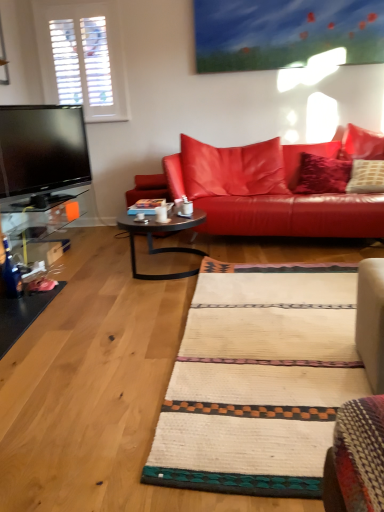
What do you see at coordinates (164, 247) in the screenshot?
I see `metallic black coffee table at center` at bounding box center [164, 247].

In order to face leather couch at center, should I rotate leftwards or rightwards?

To align with it, rotate right about 12.712°.

Describe the element at coordinates (259, 195) in the screenshot. I see `leather couch at center` at that location.

Find the location of a particular element. The width and height of the screenshot is (384, 512). white glossy mug at center is located at coordinates (161, 214).

Considering their positions, is white glossy mug at center located in front of or behind metallic black coffee table at center?

white glossy mug at center is positioned farther from the viewer than metallic black coffee table at center.

Consider the image. Which of these two, white glossy mug at center or metallic black coffee table at center, stands taller?

Standing taller between the two is metallic black coffee table at center.

What's the angular difference between white glossy mug at center and metallic black coffee table at center's facing directions?

They differ by 49.1 degrees in their facing directions.

Can we say white glossy mug at center lies outside leather couch at center?

That's correct, white glossy mug at center is outside of leather couch at center.

Measure the distance from white glossy mug at center to leather couch at center.

white glossy mug at center is 38.84 inches away from leather couch at center.

Which of these two, white glossy mug at center or leather couch at center, is smaller?

Smaller between the two is white glossy mug at center.

Which is in front, point (192, 221) or point (208, 175)?

The point (192, 221) is in front.

In the scene shown: Who is shorter, metallic black coffee table at center or leather couch at center?

Standing shorter between the two is metallic black coffee table at center.

The width and height of the screenshot is (384, 512). Identify the location of studio couch above the metallic black coffee table at center (from the image's perspective). (259, 195).

Is metallic black coffee table at center facing towards white glossy mug at center?

No, metallic black coffee table at center is not facing towards white glossy mug at center.

Considering the relative sizes of metallic black coffee table at center and white glossy mug at center in the image provided, is metallic black coffee table at center smaller than white glossy mug at center?

Incorrect, metallic black coffee table at center is not smaller in size than white glossy mug at center.

Which object is thinner, metallic black coffee table at center or white glossy mug at center?

With smaller width is white glossy mug at center.

Which object is positioned more to the left, leather couch at center or metallic black coffee table at center?

metallic black coffee table at center.

From the image's perspective, does leather couch at center appear higher than metallic black coffee table at center?

Yes, from the image's perspective, leather couch at center is on top of metallic black coffee table at center.

From a real-world perspective, is leather couch at center positioned under metallic black coffee table at center based on gravity?

Incorrect, from a real-world perspective, leather couch at center is higher than metallic black coffee table at center.

Is leather couch at center positioned with its back to metallic black coffee table at center?

No.

Is point (329, 202) closer or farther from the camera than point (165, 215)?

Clearly, point (329, 202) is more distant from the camera than point (165, 215).

Do you think leather couch at center is within white glossy mug at center, or outside of it?

leather couch at center lies outside white glossy mug at center.

From a real-world perspective, is leather couch at center physically located above or below white glossy mug at center?

leather couch at center is situated higher than white glossy mug at center in the real world.

Can you confirm if leather couch at center is wider than white glossy mug at center?

Yes.

Where is `coffee table located underneath the white glossy mug at center (from a real-world perspective)`? This screenshot has height=512, width=384. coffee table located underneath the white glossy mug at center (from a real-world perspective) is located at coordinates (164, 247).

Image resolution: width=384 pixels, height=512 pixels. I want to click on studio couch above the white glossy mug at center (from the image's perspective), so click(x=259, y=195).

From the image, which object appears to be nearer to white glossy mug at center, metallic black coffee table at center or leather couch at center?

Based on the image, metallic black coffee table at center appears to be nearer to white glossy mug at center.

When comparing their distances from leather couch at center, does metallic black coffee table at center or white glossy mug at center seem closer?

metallic black coffee table at center.

From the image, which object appears to be nearer to metallic black coffee table at center, leather couch at center or white glossy mug at center?

Among the two, white glossy mug at center is located nearer to metallic black coffee table at center.

From the image, which object appears to be farther from metallic black coffee table at center, white glossy mug at center or leather couch at center?

leather couch at center.

Estimate the real-world distances between objects in this image. Which object is further from leather couch at center, white glossy mug at center or metallic black coffee table at center?

The object further to leather couch at center is white glossy mug at center.

When comparing their distances from white glossy mug at center, does leather couch at center or metallic black coffee table at center seem closer?

metallic black coffee table at center lies closer to white glossy mug at center than the other object.

Where is `coffee table situated between white glossy mug at center and leather couch at center from left to right`? Image resolution: width=384 pixels, height=512 pixels. coffee table situated between white glossy mug at center and leather couch at center from left to right is located at coordinates (164, 247).